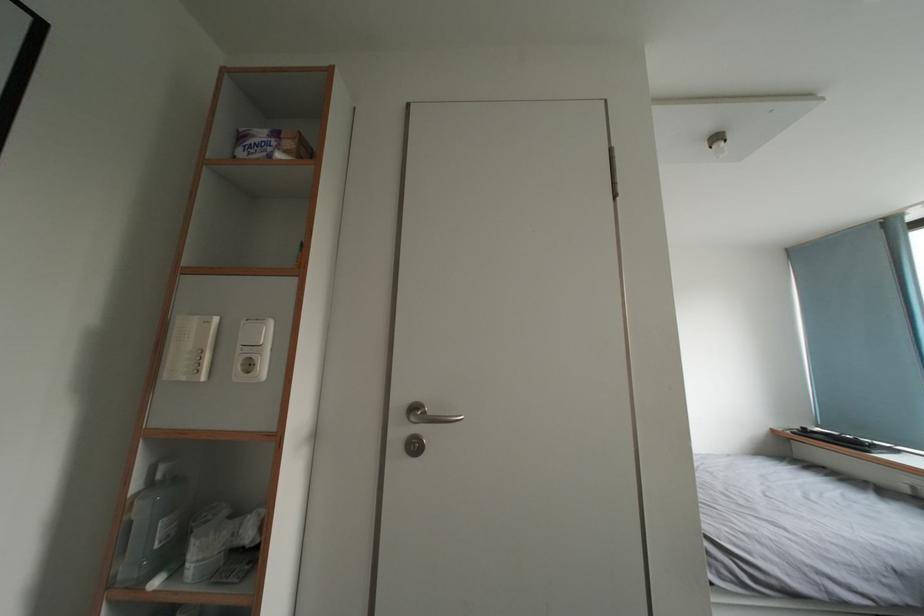
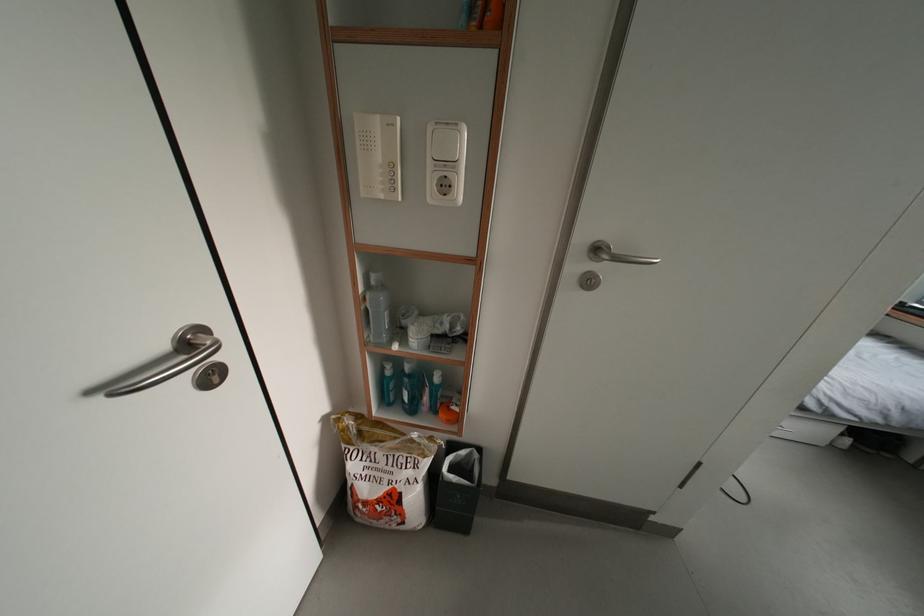
Question: Based on the continuous images, in which direction is the camera rotating? Reply with the corresponding letter.

Choices:
 (A) Left
 (B) Right
 (C) Up
 (D) Down

Answer: (D)